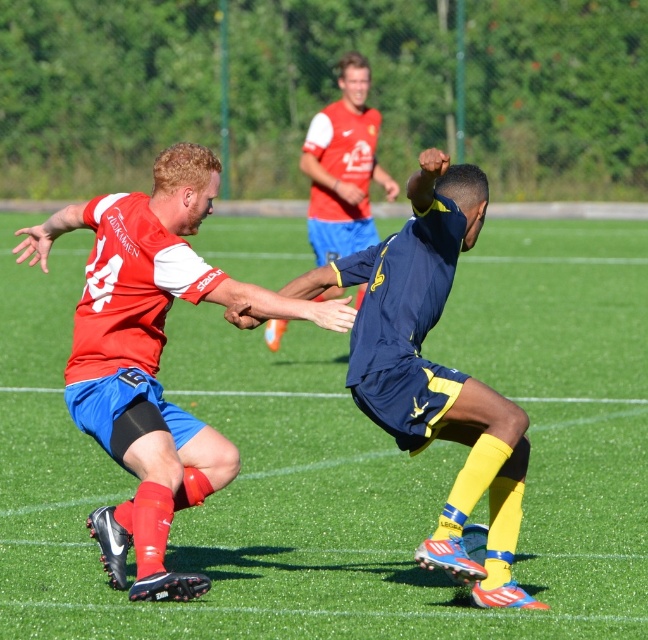
You are a soccer player standing at the point with coordinates point (178, 264). You want to kick a ball to your teammate who is 7 meters away from you. Can you reach your teammate with a single kick?

The distance between point (178, 264) and the viewer is 6.52 meters. Since the teammate is 7 meters away, the kick might not reach them unless you can kick further than 6.52 meters.

You are a soccer referee observing the match. You need to determine if the matte blue shorts at center are on the green grass football field at center. Based on the spatial relationship between them, can you confirm this?

The green grass football field at center is in front of matte blue shorts at center, which means the matte blue shorts at center are positioned behind the field. Therefore, the matte blue shorts at center are not on the green grass football field at center.

You are a soccer player standing on the green grass football field at center. You want to pass the ball to your teammate wearing blue matte shorts at center. Since you can see both objects, which one is closer to you?

The blue matte shorts at center is closer to you because the green grass football field at center is further away from the viewer, meaning the shorts are nearer to your position.